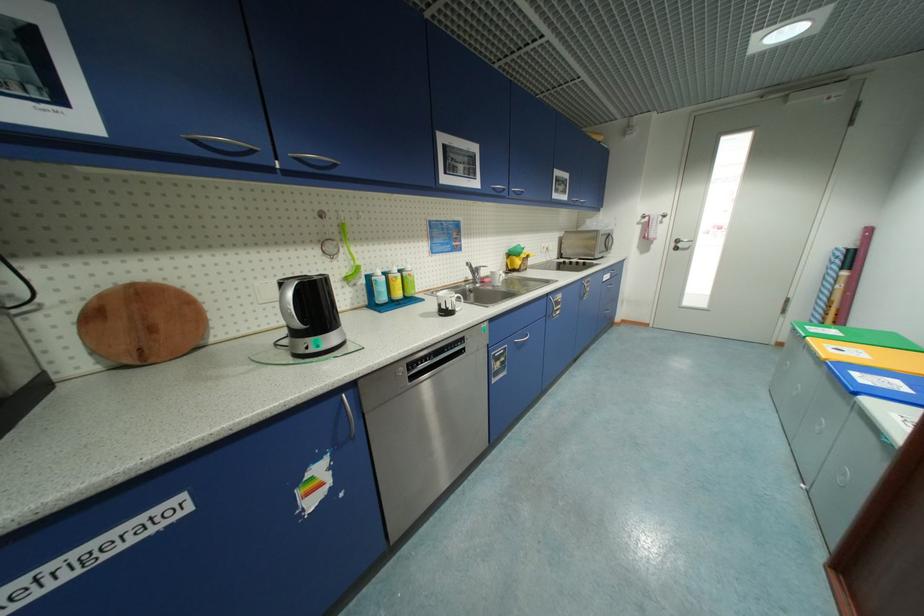
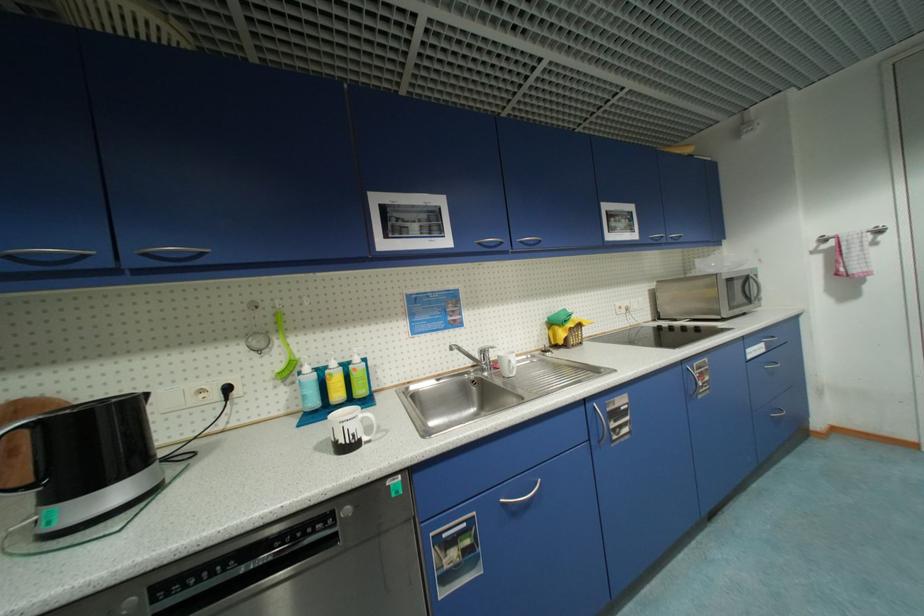
The images are taken continuously from a first-person perspective. In which direction are you moving?

The movement direction of the cameraman is right, forward.